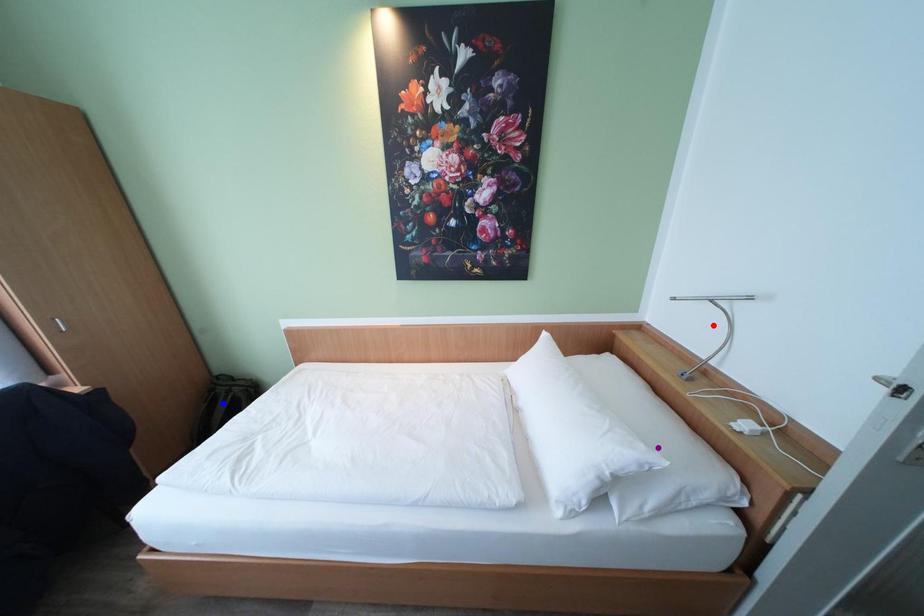
Order these from farthest to nearest:
A) purple point
B) red point
C) blue point

blue point, red point, purple point